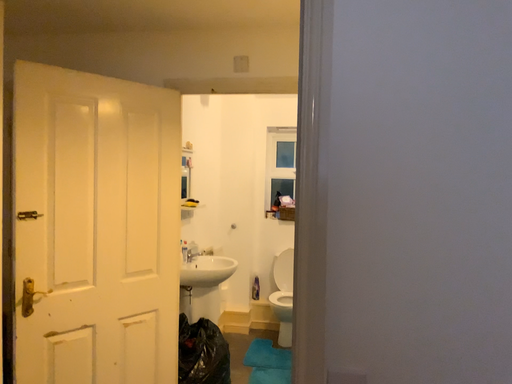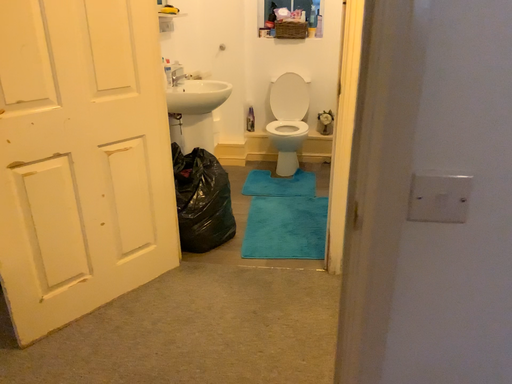
Question: Which way did the camera rotate in the video?

Choices:
 (A) rotated upward
 (B) rotated downward

Answer: (B)